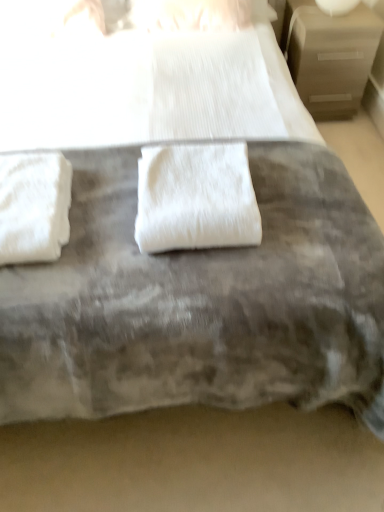
This screenshot has height=512, width=384. I want to click on vacant space in front of white glossy table lamp at upper right, so click(342, 24).